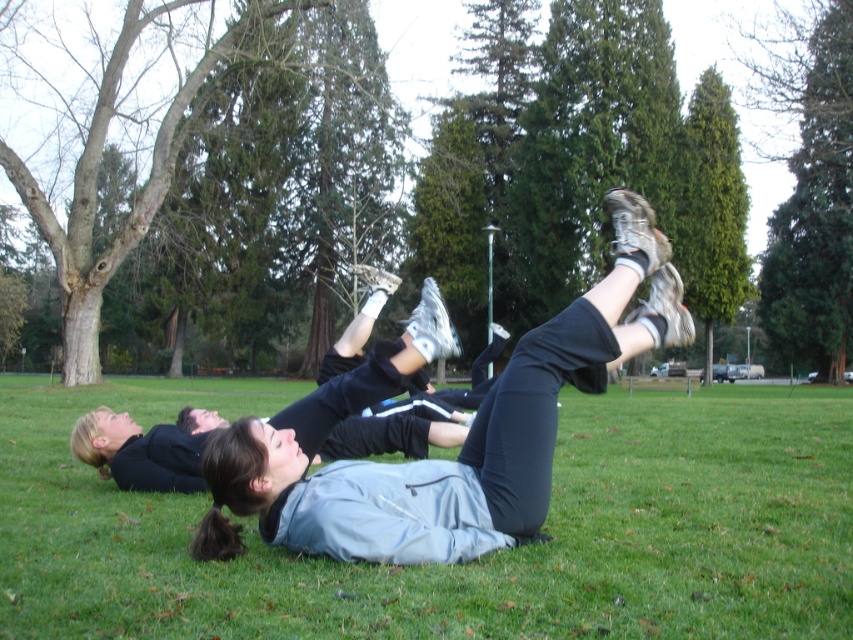
In the scene shown: You are standing at the origin point in the image. Which of the two points, point (47,618) or point (576,346), is closer to you?

Point (47,618) is closer to you because it is in front of point (576,346).

You are a drone operator trying to capture a closeup of the green grass at center. Based on the coordinates provided in the Objects Description, which area of the image should you focus on?

The green grass at center is located at point (467, 563), so you should focus on that coordinate to capture the closeup.

You are standing at the point marked as point (x=467, y=563) in the image. What is the color of the ground beneath your feet?

The point (x=467, y=563) is on green grass at center, so the ground beneath your feet is green.